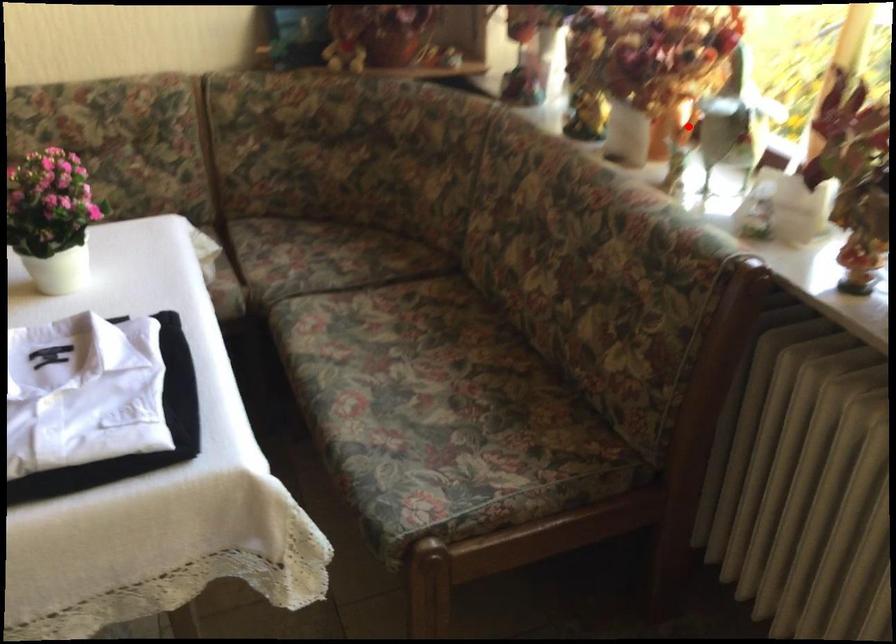
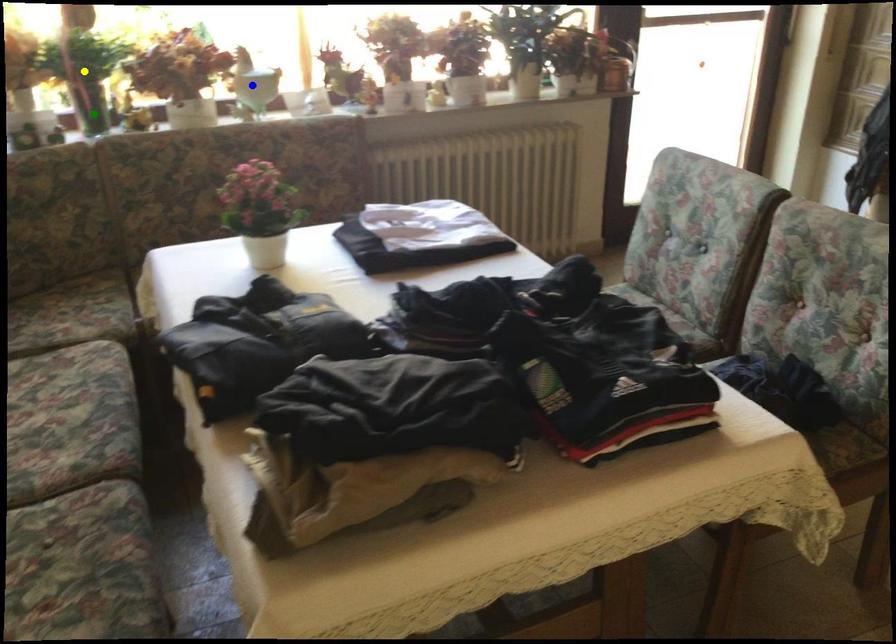
Question: I am providing you with two images of the same scene from different viewpoints. A red point is marked on the first image. You are given multiple points on the second image. Can you choose the point in image 2 that corresponds to the point in image 1?

Choices:
 (A) yellow point
 (B) green point
 (C) blue point

Answer: (C)